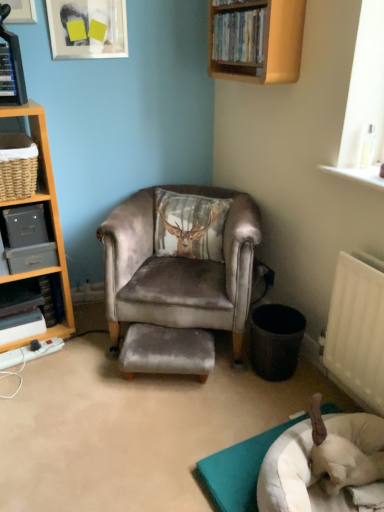
Question: Is woven brown basket at left, positioned as the 3th shelf in bottom-to-top order, shorter than black plastic trash can at lower right?

Choices:
 (A) no
 (B) yes

Answer: (B)

Question: Can we say woven brown basket at left, acting as the third shelf starting from the left, lies outside black plastic trash can at lower right?

Choices:
 (A) yes
 (B) no

Answer: (A)

Question: Is woven brown basket at left, acting as the third shelf starting from the left, to the left of black plastic trash can at lower right from the viewer's perspective?

Choices:
 (A) no
 (B) yes

Answer: (B)

Question: Is woven brown basket at left, acting as the third shelf starting from the left, to the right of black plastic trash can at lower right from the viewer's perspective?

Choices:
 (A) no
 (B) yes

Answer: (A)

Question: From the image's perspective, is woven brown basket at left, acting as the third shelf starting from the left, below black plastic trash can at lower right?

Choices:
 (A) yes
 (B) no

Answer: (B)

Question: Considering the positions of point (11, 343) and point (231, 474), is point (11, 343) closer or farther from the camera than point (231, 474)?

Choices:
 (A) closer
 (B) farther

Answer: (B)

Question: Is metallic gray shelf at left, which ranks as the 1th shelf in left-to-right order, in front of or behind white fabric dog bed at lower right in the image?

Choices:
 (A) front
 (B) behind

Answer: (B)

Question: From their relative heights in the image, would you say metallic gray shelf at left, which is the first shelf from bottom to top, is taller or shorter than white fabric dog bed at lower right?

Choices:
 (A) tall
 (B) short

Answer: (A)

Question: Visually, is metallic gray shelf at left, which is the first shelf from bottom to top, positioned to the left or to the right of white fabric dog bed at lower right?

Choices:
 (A) left
 (B) right

Answer: (A)

Question: Relative to wooden shelf at upper center, positioned as the first shelf in top-to-bottom order, is hardcover book at left, marked as the first book in a front-to-back arrangement, in front or behind?

Choices:
 (A) front
 (B) behind

Answer: (B)

Question: Visually, is hardcover book at left, marked as the first book in a front-to-back arrangement, positioned to the left or to the right of wooden shelf at upper center, the 1th shelf in the right-to-left sequence?

Choices:
 (A) left
 (B) right

Answer: (A)

Question: From a real-world perspective, relative to wooden shelf at upper center, positioned as the first shelf in top-to-bottom order, is hardcover book at left, acting as the 2th book starting from the bottom, vertically above or below?

Choices:
 (A) below
 (B) above

Answer: (A)

Question: From the image's perspective, is hardcover book at left, marked as the first book in a front-to-back arrangement, positioned above or below wooden shelf at upper center, marked as the 4th shelf in a left-to-right arrangement?

Choices:
 (A) below
 (B) above

Answer: (A)

Question: From the image's perspective, is white fabric dog bed at lower right positioned above or below metallic gray shelf at left, which ranks as the 1th shelf in left-to-right order?

Choices:
 (A) below
 (B) above

Answer: (A)

Question: Considering the relative positions of white fabric dog bed at lower right and metallic gray shelf at left, the 4th shelf when ordered from right to left, in the image provided, is white fabric dog bed at lower right to the left or to the right of metallic gray shelf at left, the 4th shelf when ordered from right to left,?

Choices:
 (A) left
 (B) right

Answer: (B)